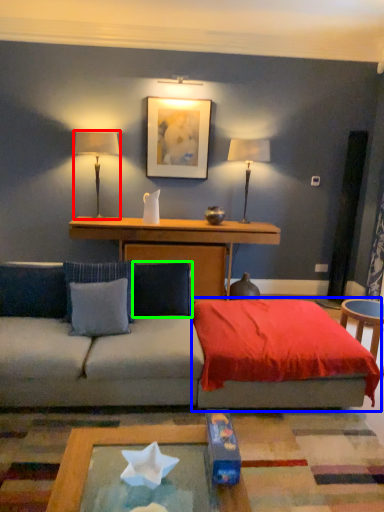
Question: Estimate the real-world distances between objects in this image. Which object is closer to table lamp (highlighted by a red box), bedding (highlighted by a blue box) or pillow (highlighted by a green box)?

Choices:
 (A) bedding
 (B) pillow

Answer: (B)